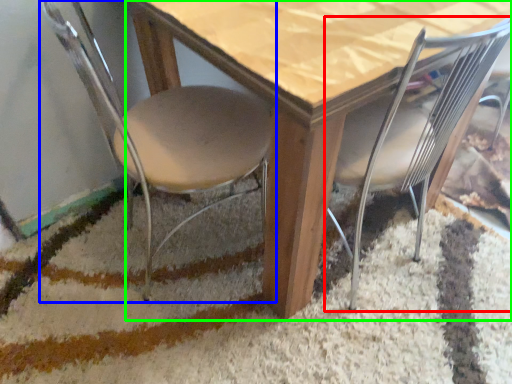
Question: Estimate the real-world distances between objects in this image. Which object is closer to chair (highlighted by a red box), chair (highlighted by a blue box) or table (highlighted by a green box)?

Choices:
 (A) chair
 (B) table

Answer: (B)